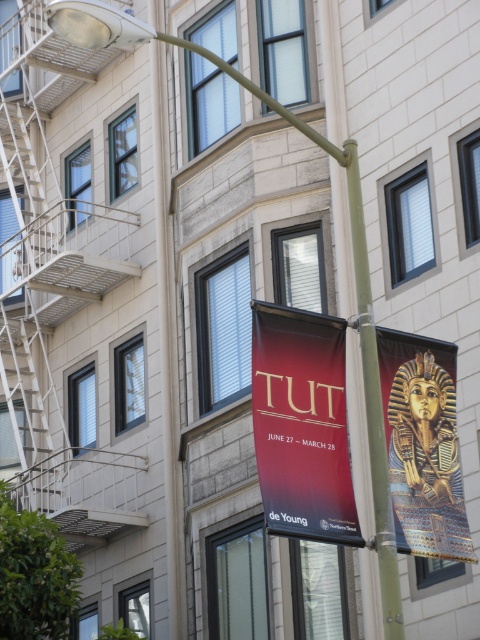
Question: Is matte gold banner at center thinner than gold metallic pharaoh mask at right?

Choices:
 (A) no
 (B) yes

Answer: (B)

Question: From the image, what is the correct spatial relationship of matte gold banner at center in relation to gold metallic pharaoh mask at right?

Choices:
 (A) above
 (B) below

Answer: (A)

Question: Which of the following is the farthest from the observer?

Choices:
 (A) matte gold banner at center
 (B) gold metallic pharaoh mask at right

Answer: (B)

Question: Considering the relative positions of matte gold banner at center and gold metallic pharaoh mask at right in the image provided, where is matte gold banner at center located with respect to gold metallic pharaoh mask at right?

Choices:
 (A) above
 (B) below

Answer: (A)